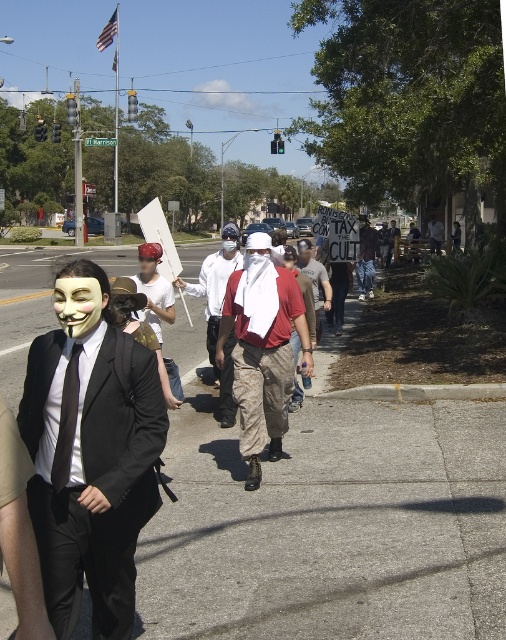
Measure the distance between camouflage pants at center and camera.

camouflage pants at center is 5.61 meters away from camera.

Between point (257, 486) and point (442, 234), which one is positioned behind?

Point (442, 234)

The width and height of the screenshot is (506, 640). Find the location of `camouflage pants at center`. camouflage pants at center is located at coordinates (263, 349).

How much distance is there between matte black suit at left and denim pants at center?

matte black suit at left is 43.35 feet from denim pants at center.

Is matte black suit at left wider than denim pants at center?

In fact, matte black suit at left might be narrower than denim pants at center.

Who is more distant from viewer, (41,358) or (364,284)?

Point (364,284)

Identify the location of matte black suit at left. The width and height of the screenshot is (506, 640). (91, 452).

Can you confirm if camouflage pants at center is positioned above white matte mask at left?

Actually, camouflage pants at center is below white matte mask at left.

Is camouflage pants at center wider than white matte mask at left?

No, camouflage pants at center is not wider than white matte mask at left.

Between point (264, 396) and point (138, 256), which one is positioned behind?

Point (138, 256)

Locate an element on the screen. This screenshot has width=506, height=640. camouflage pants at center is located at coordinates (263, 349).